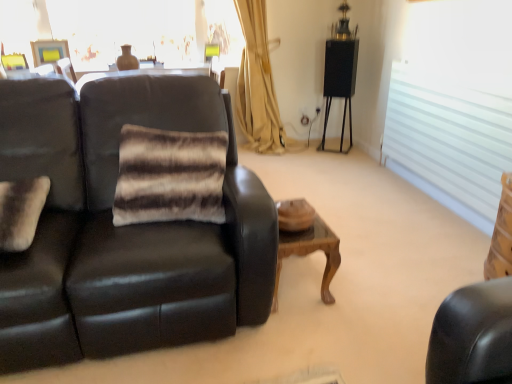
This screenshot has width=512, height=384. What do you see at coordinates (454, 105) in the screenshot? I see `white frosted glass window at right, placed as the 1th window when sorted from front to back` at bounding box center [454, 105].

How much space does brown striped fur pillow at center, arranged as the first pillow when viewed from the right, occupy horizontally?

It is 42.00 centimeters.

What do you see at coordinates (169, 176) in the screenshot? Image resolution: width=512 pixels, height=384 pixels. I see `brown striped fur pillow at center, arranged as the first pillow when viewed from the right` at bounding box center [169, 176].

How much space does translucent glass window at upper center, marked as the second window in a bottom-to-top arrangement, occupy horizontally?

translucent glass window at upper center, marked as the second window in a bottom-to-top arrangement, is 5.26 inches wide.

At what (x,y) coordinates should I click in order to perform the action: click on white frosted glass window at right, the second window when ordered from top to bottom. Please return your answer as a coordinate pair (x, y). Looking at the image, I should click on (454, 105).

Measure the distance from woodenwoodentable at center to fuzzy white pillow at left, which ranks as the second pillow in right-to-left order.

They are 3.45 feet apart.

Is woodenwoodentable at center positioned behind fuzzy white pillow at left, which ranks as the second pillow in right-to-left order?

Yes, woodenwoodentable at center is further from the camera.

Between woodenwoodentable at center and fuzzy white pillow at left, which ranks as the second pillow in right-to-left order, which one has less height?

fuzzy white pillow at left, which ranks as the second pillow in right-to-left order, is shorter.

From the image's perspective, starting from the woodenwoodentable at center, which pillow is the 1st one above? Please provide its 2D coordinates.

[(21, 211)]

How different are the orientations of brown striped fur pillow at center, arranged as the first pillow when viewed from the right, and woodenwoodentable at center in degrees?

They differ by 0.976 degrees in their facing directions.

Would you consider brown striped fur pillow at center, arranged as the first pillow when viewed from the right, to be distant from woodenwoodentable at center?

No, brown striped fur pillow at center, arranged as the first pillow when viewed from the right, is not far away from woodenwoodentable at center.

Which of these two, brown striped fur pillow at center, arranged as the first pillow when viewed from the right, or woodenwoodentable at center, is bigger?

brown striped fur pillow at center, arranged as the first pillow when viewed from the right.

Which is in front, brown striped fur pillow at center, arranged as the first pillow when viewed from the right, or woodenwoodentable at center?

brown striped fur pillow at center, arranged as the first pillow when viewed from the right, is closer to the camera.

In the scene shown: Based on their sizes in the image, would you say brown striped fur pillow at center, the 2th pillow from the left, is bigger or smaller than fuzzy white pillow at left, which ranks as the second pillow in right-to-left order?

Clearly, brown striped fur pillow at center, the 2th pillow from the left, is larger in size than fuzzy white pillow at left, which ranks as the second pillow in right-to-left order.

From the image's perspective, does brown striped fur pillow at center, the 2th pillow from the left, appear higher than fuzzy white pillow at left, which ranks as the second pillow in right-to-left order?

Yes.

Does brown striped fur pillow at center, the 2th pillow from the left, have a greater height compared to fuzzy white pillow at left, which is the 1th pillow from left to right?

Correct, brown striped fur pillow at center, the 2th pillow from the left, is much taller as fuzzy white pillow at left, which is the 1th pillow from left to right.

Can you confirm if woodenwoodentable at center is shorter than brown striped fur pillow at center, the 2th pillow from the left?

Yes, woodenwoodentable at center is shorter than brown striped fur pillow at center, the 2th pillow from the left.

Based on their sizes in the image, would you say woodenwoodentable at center is bigger or smaller than brown striped fur pillow at center, arranged as the first pillow when viewed from the right?

woodenwoodentable at center is smaller than brown striped fur pillow at center, arranged as the first pillow when viewed from the right.

Consider the image. Does woodenwoodentable at center turn towards brown striped fur pillow at center, arranged as the first pillow when viewed from the right?

No.

From a real-world perspective, does woodenwoodentable at center sit lower than brown striped fur pillow at center, the 2th pillow from the left?

Yes, from a real-world perspective, woodenwoodentable at center is under brown striped fur pillow at center, the 2th pillow from the left.

Looking at the image, does woodenwoodentable at center seem bigger or smaller compared to matte black couch at left?

woodenwoodentable at center is smaller than matte black couch at left.

Which of these two, woodenwoodentable at center or matte black couch at left, is thinner?

woodenwoodentable at center.

Where is `pillow above the fuzzy white pillow at left, which ranks as the second pillow in right-to-left order (from the image's perspective)`? This screenshot has width=512, height=384. pillow above the fuzzy white pillow at left, which ranks as the second pillow in right-to-left order (from the image's perspective) is located at coordinates (169, 176).

In terms of width, does fuzzy white pillow at left, which is the 1th pillow from left to right, look wider or thinner when compared to brown striped fur pillow at center, arranged as the first pillow when viewed from the right?

Considering their sizes, fuzzy white pillow at left, which is the 1th pillow from left to right, looks broader than brown striped fur pillow at center, arranged as the first pillow when viewed from the right.

Would you say fuzzy white pillow at left, which ranks as the second pillow in right-to-left order, is inside or outside brown striped fur pillow at center, arranged as the first pillow when viewed from the right?

fuzzy white pillow at left, which ranks as the second pillow in right-to-left order, is located beyond the bounds of brown striped fur pillow at center, arranged as the first pillow when viewed from the right.

Can you confirm if fuzzy white pillow at left, which is the 1th pillow from left to right, is shorter than brown striped fur pillow at center, the 2th pillow from the left?

Yes.

Is matte black couch at left facing away from fuzzy white pillow at left, which ranks as the second pillow in right-to-left order?

Yes, fuzzy white pillow at left, which ranks as the second pillow in right-to-left order, is at the back of matte black couch at left.

Which is less distant, (240, 221) or (30, 210)?

Positioned in front is point (240, 221).

Looking at this image, from a real-world perspective, which is physically above, matte black couch at left or fuzzy white pillow at left, which is the 1th pillow from left to right?

fuzzy white pillow at left, which is the 1th pillow from left to right.

From the image's perspective, is matte black couch at left located beneath fuzzy white pillow at left, which is the 1th pillow from left to right?

No, from the image's perspective, matte black couch at left is not beneath fuzzy white pillow at left, which is the 1th pillow from left to right.

This screenshot has width=512, height=384. I want to click on table below the fuzzy white pillow at left, which is the 1th pillow from left to right (from a real-world perspective), so click(x=306, y=242).

Locate an element on the screen. The width and height of the screenshot is (512, 384). the 1st pillow in front of the woodenwoodentable at center, starting your count from the anchor is located at coordinates (169, 176).

Based on their spatial positions, is fuzzy white pillow at left, which ranks as the second pillow in right-to-left order, or translucent glass window at upper center, which is counted as the second window, starting from the front, closer to woodenwoodentable at center?

The object closer to woodenwoodentable at center is fuzzy white pillow at left, which ranks as the second pillow in right-to-left order.

From the image, which object appears to be farther from woodenwoodentable at center, matte black couch at left or fuzzy white pillow at left, which is the 1th pillow from left to right?

fuzzy white pillow at left, which is the 1th pillow from left to right.

Looking at the image, which one is located closer to woodenwoodentable at center, brown striped fur pillow at center, the 2th pillow from the left, or translucent glass window at upper center, placed as the first window when sorted from back to front?

Based on the image, brown striped fur pillow at center, the 2th pillow from the left, appears to be nearer to woodenwoodentable at center.

Looking at the image, which one is located closer to white frosted glass window at right, the second window positioned from the back, translucent glass window at upper center, positioned as the 1th window in left-to-right order, or brown striped fur pillow at center, the 2th pillow from the left?

Based on the image, brown striped fur pillow at center, the 2th pillow from the left, appears to be nearer to white frosted glass window at right, the second window positioned from the back.

From the image, which object appears to be farther from translucent glass window at upper center, which is counted as the second window, starting from the right, white frosted glass window at right, the second window positioned from the back, or fuzzy white pillow at left, which ranks as the second pillow in right-to-left order?

fuzzy white pillow at left, which ranks as the second pillow in right-to-left order.

Based on their spatial positions, is brown striped fur pillow at center, the 2th pillow from the left, or woodenwoodentable at center further from white frosted glass window at right, the 1th window positioned from the right?

brown striped fur pillow at center, the 2th pillow from the left, is further to white frosted glass window at right, the 1th window positioned from the right.

Which object lies nearer to the anchor point translucent glass window at upper center, placed as the first window when sorted from back to front, fuzzy white pillow at left, which ranks as the second pillow in right-to-left order, or matte black couch at left?

Based on the image, matte black couch at left appears to be nearer to translucent glass window at upper center, placed as the first window when sorted from back to front.

When comparing their distances from fuzzy white pillow at left, which ranks as the second pillow in right-to-left order, does white frosted glass window at right, which ranks as the second window in left-to-right order, or woodenwoodentable at center seem closer?

woodenwoodentable at center.

Locate an element on the screen. Image resolution: width=512 pixels, height=384 pixels. pillow located between fuzzy white pillow at left, which is the 1th pillow from left to right, and white frosted glass window at right, which ranks as the second window in left-to-right order, in the left-right direction is located at coordinates (169, 176).

Where is `studio couch located between fuzzy white pillow at left, which is the 1th pillow from left to right, and woodenwoodentable at center in the left-right direction`? This screenshot has width=512, height=384. studio couch located between fuzzy white pillow at left, which is the 1th pillow from left to right, and woodenwoodentable at center in the left-right direction is located at coordinates pos(124,228).

Locate an element on the screen. This screenshot has height=384, width=512. table situated between matte black couch at left and white frosted glass window at right, which ranks as the second window in left-to-right order, from left to right is located at coordinates 306,242.

Locate an element on the screen. The image size is (512, 384). pillow between fuzzy white pillow at left, which is the 1th pillow from left to right, and translucent glass window at upper center, which is counted as the second window, starting from the right, from front to back is located at coordinates (169, 176).